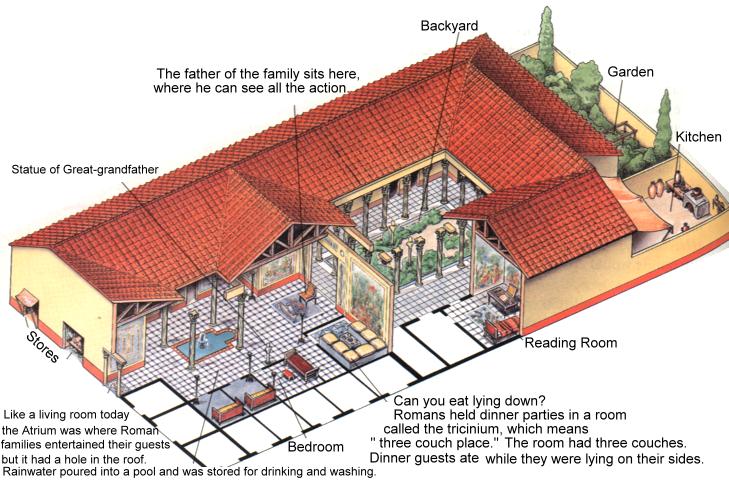
Find the location of `4 poles in this room`. 4 poles in this room is located at coordinates (195, 347), (241, 324), (210, 305), (159, 326).